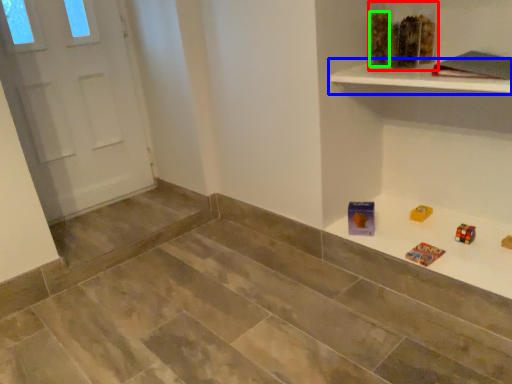
Question: Which object is positioned farthest from toy (highlighted by a red box)? Select from shelf (highlighted by a blue box) and block (highlighted by a green box).

Choices:
 (A) shelf
 (B) block

Answer: (A)